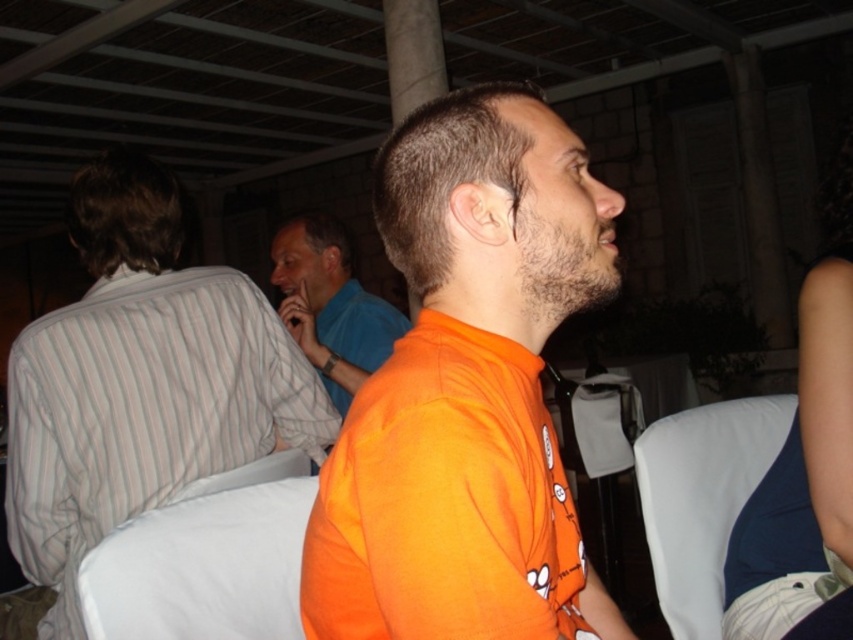
You are organizing a clothing display and need to arrange the orange cotton shirt at center and the blue smooth shirt at center side by side. Which shirt should be placed on the left to ensure they fit within a 1.5 meter wide display area?

The orange cotton shirt at center has a smaller width than the blue smooth shirt at center. To fit within the 1.5 meter display area, place the narrower orange cotton shirt at center on the left and the wider blue smooth shirt at center on the right, ensuring their combined width does not exceed the available space.

You are a photographer at the event and want to capture a photo of the striped cotton shirt at left without the white fabric chair at right appearing in the background. Is this possible based on their positions?

The striped cotton shirt at left is in front of the white fabric chair at right, so the chair will be behind the shirt in the photo. Therefore, it is possible to capture the striped cotton shirt at left without the white fabric chair at right in the background by focusing on the shirt and ensuring the chair is out of frame.